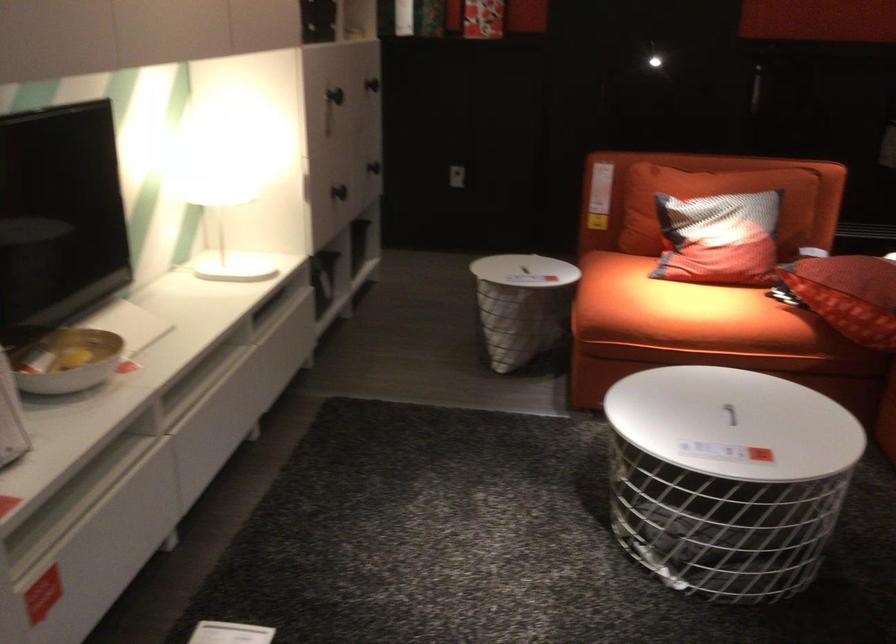
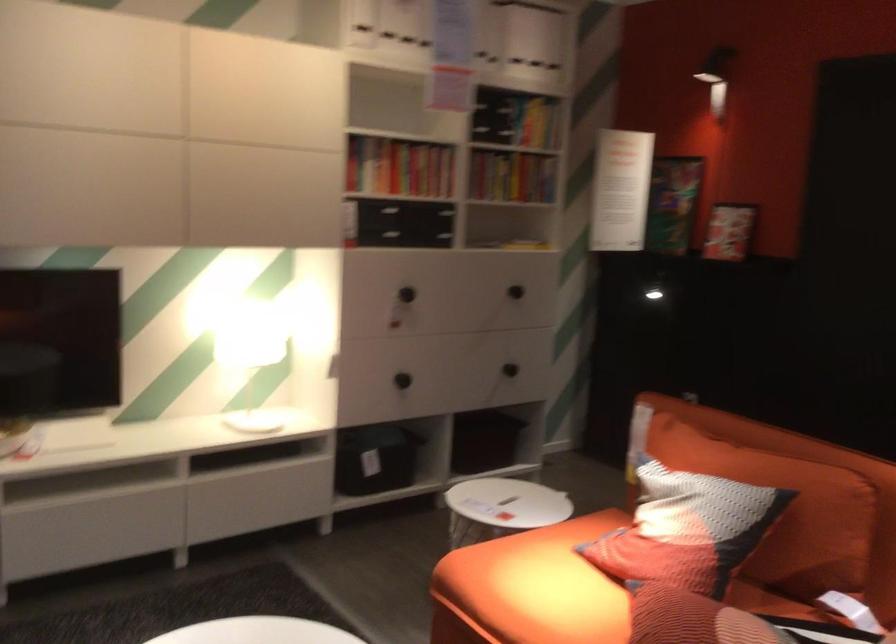
Where in the second image is the point corresponding to point (760, 225) from the first image?

(686, 529)